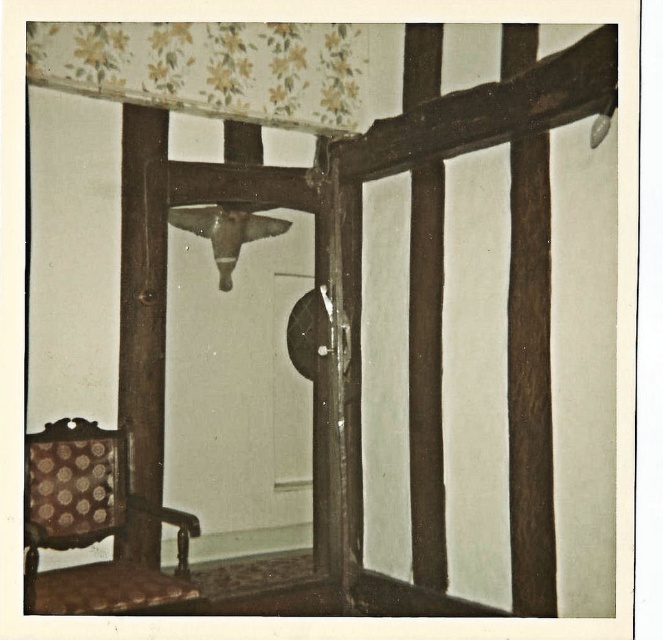
You are standing in the room with the wooden framed window or door. You need to place a small table next to the patterned fabric chair at lower left. Where should you place the table to ensure it is near the chair?

Place the table near the patterned fabric chair at lower left at coordinates approximately [91,524] to ensure proximity.

You are an interior designer assessing the room layout. You notice the floral wallpaper at upper center and the dark brown wood at center. Which of these two elements is positioned to the left when viewed from the front of the room?

The floral wallpaper at upper center is positioned to the left of the dark brown wood at center.

You are standing in the room with the wooden framed window or door. You see two points marked in the image. The first point is at coordinates point [522,241] and the second point is at point [229,256]. Which point is closer to you?

Point [522,241] is in front of point [229,256], so the first point is closer to you.